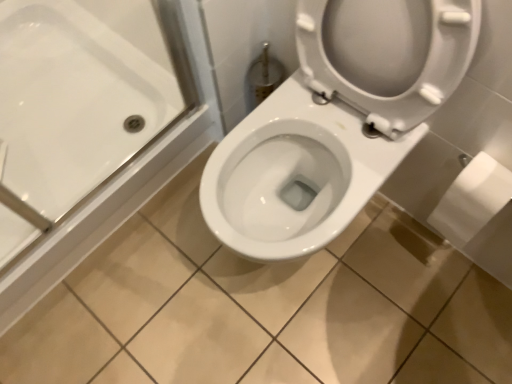
Question: Which is correct: white glossy bathtub at upper left is inside white matte toilet paper at right, or outside of it?

Choices:
 (A) outside
 (B) inside

Answer: (A)

Question: Considering the positions of white glossy bathtub at upper left and white matte toilet paper at right in the image, is white glossy bathtub at upper left bigger or smaller than white matte toilet paper at right?

Choices:
 (A) big
 (B) small

Answer: (A)

Question: Which is farther from the white glossy bathtub at upper left?

Choices:
 (A) white matte toilet paper at right
 (B) white glossy toilet at center

Answer: (A)

Question: Which of these objects is positioned farthest from the white glossy bathtub at upper left?

Choices:
 (A) white matte toilet paper at right
 (B) white glossy toilet at center

Answer: (A)